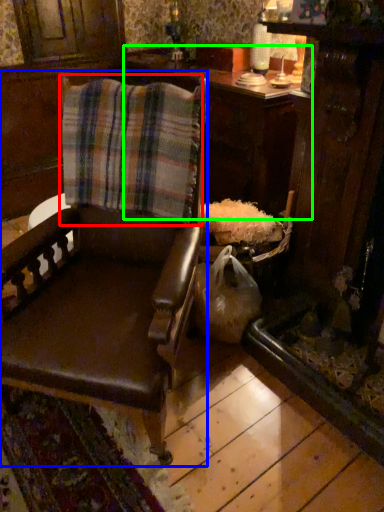
Question: Considering the real-world distances, which object is closest to flannel (highlighted by a red box)? chair (highlighted by a blue box) or table (highlighted by a green box).

Choices:
 (A) chair
 (B) table

Answer: (A)